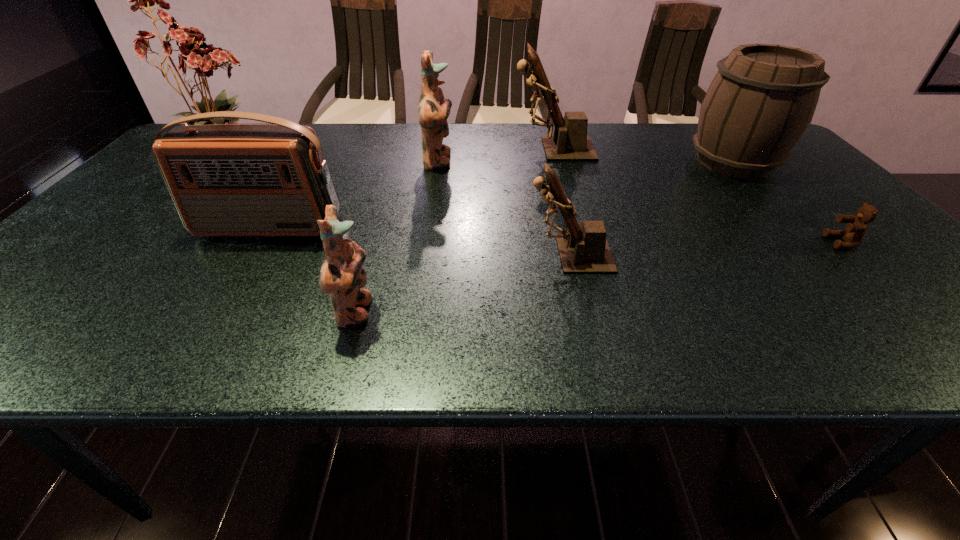
Where is `vacant area situated on the front-facing side of the nearer brown figurine`? The image size is (960, 540). vacant area situated on the front-facing side of the nearer brown figurine is located at coordinates (486, 256).

The image size is (960, 540). Identify the location of vacant area situated on the front-facing side of the nearer brown figurine. (413, 256).

At what (x,y) coordinates should I click in order to perform the action: click on vacant space located 0.260m on the front-facing side of the left pink figurine. Please return your answer as a coordinate pair (x, y). Looking at the image, I should click on coord(510,313).

Identify the location of free spot located 0.080m on the face of the teddy bear. (793, 242).

You are a GUI agent. You are given a task and a screenshot of the screen. Output one action in this format:
    pyautogui.click(x=<x>, y=<y>)
    Task: Click on the free location located on the face of the teddy bear
    
    Given the screenshot: What is the action you would take?
    pyautogui.click(x=797, y=242)

The width and height of the screenshot is (960, 540). Identify the location of vacant space positioned on the face of the teddy bear. (797, 242).

Image resolution: width=960 pixels, height=540 pixels. Identify the location of flower arrangement that is at the far edge. (205, 60).

Identify the location of wine bucket located in the far edge section of the desktop. Image resolution: width=960 pixels, height=540 pixels. (761, 101).

Identify the location of object that is at the near edge. (342, 275).

Locate an element on the screen. object that is at the left edge is located at coordinates (205, 60).